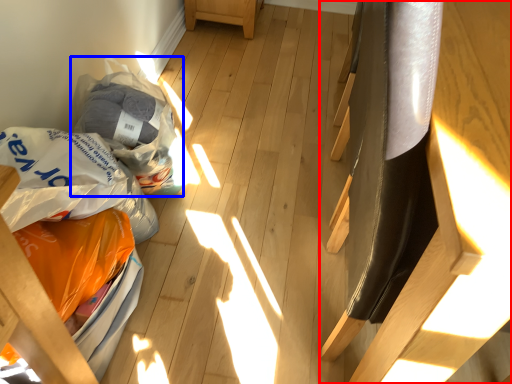
Question: Which object is closer to the camera taking this photo, furniture (highlighted by a red box) or grocery bag (highlighted by a blue box)?

Choices:
 (A) furniture
 (B) grocery bag

Answer: (A)